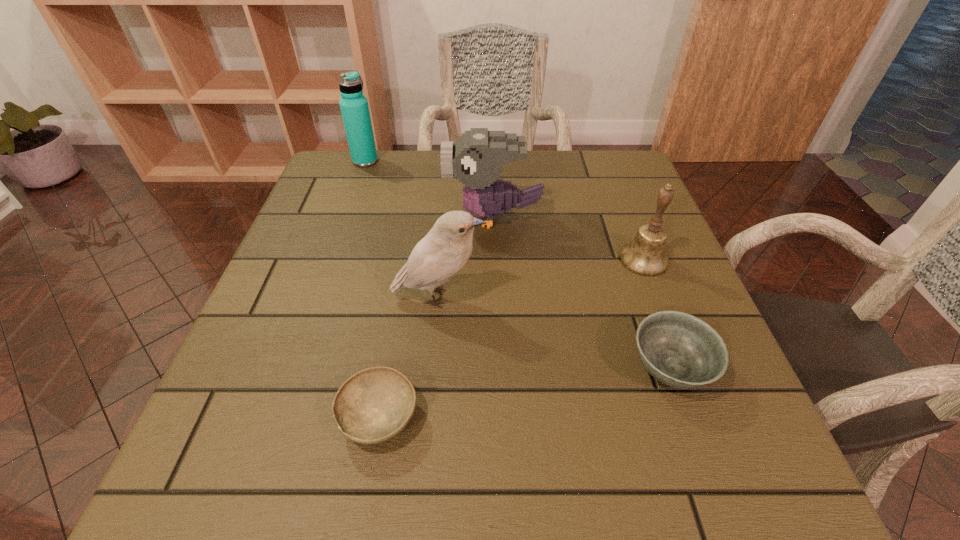
Where is `vacant space that satisfies the following two spatial constraints: 1. at the beak of the second farthest object; 2. on the back side of the third farthest object`? The width and height of the screenshot is (960, 540). vacant space that satisfies the following two spatial constraints: 1. at the beak of the second farthest object; 2. on the back side of the third farthest object is located at coordinates (494, 259).

Image resolution: width=960 pixels, height=540 pixels. Identify the location of vacant position in the image that satisfies the following two spatial constraints: 1. at the beak of the third nearest object; 2. on the back side of the fifth tallest object. (432, 368).

The height and width of the screenshot is (540, 960). What are the coordinates of `blank area in the image that satisfies the following two spatial constraints: 1. at the beak of the farther bird; 2. on the right side of the taller bowl` in the screenshot? It's located at (498, 368).

Where is `free location that satisfies the following two spatial constraints: 1. at the beak of the fifth nearest object; 2. on the right side of the bell`? The height and width of the screenshot is (540, 960). free location that satisfies the following two spatial constraints: 1. at the beak of the fifth nearest object; 2. on the right side of the bell is located at coordinates (494, 259).

What are the coordinates of `free point that satisfies the following two spatial constraints: 1. at the beak of the farther bird; 2. on the left side of the second shortest object` in the screenshot? It's located at (498, 368).

The width and height of the screenshot is (960, 540). I want to click on vacant space that satisfies the following two spatial constraints: 1. at the beak of the right bowl; 2. on the right side of the fifth nearest object, so click(498, 368).